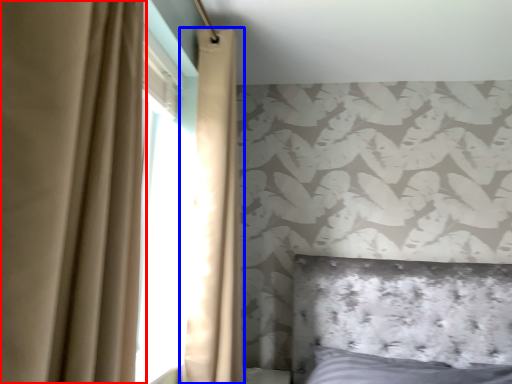
Question: Which object appears farthest to the camera in this image, curtain (highlighted by a red box) or curtain (highlighted by a blue box)?

Choices:
 (A) curtain
 (B) curtain

Answer: (B)